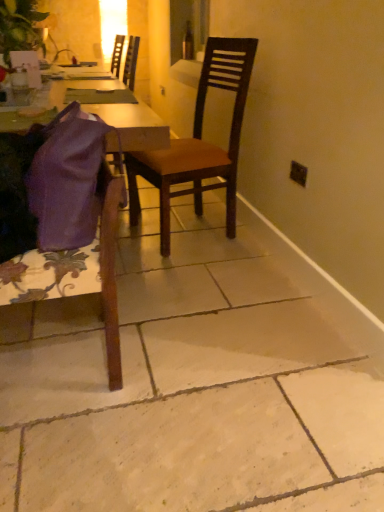
Question: From a real-world perspective, is transparent glass bottle at center positioned above or below green leafy plant at upper left?

Choices:
 (A) below
 (B) above

Answer: (A)

Question: Considering their positions, is transparent glass bottle at center located in front of or behind green leafy plant at upper left?

Choices:
 (A) front
 (B) behind

Answer: (B)

Question: Considering the real-world distances, which object is closest to the purple fabric at left?

Choices:
 (A) transparent glass bottle at center
 (B) green leafy plant at upper left
 (C) purple fabric bag at lower left, the 1th chair from the front
 (D) black plastic power outlet at upper right
 (E) brown wooden chair at center, arranged as the second chair when viewed from the front

Answer: (C)

Question: Which of these objects is positioned farthest from the black plastic power outlet at upper right?

Choices:
 (A) green leafy plant at upper left
 (B) brown wooden chair at center, the 1th chair when ordered from back to front
 (C) transparent glass bottle at center
 (D) purple fabric bag at lower left, the 2th chair from the back
 (E) purple fabric at left

Answer: (C)